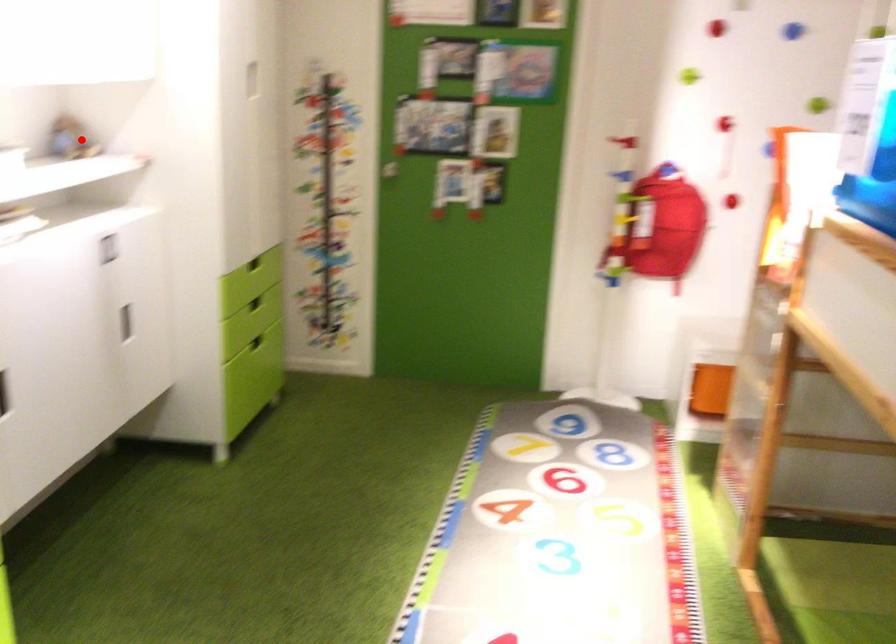
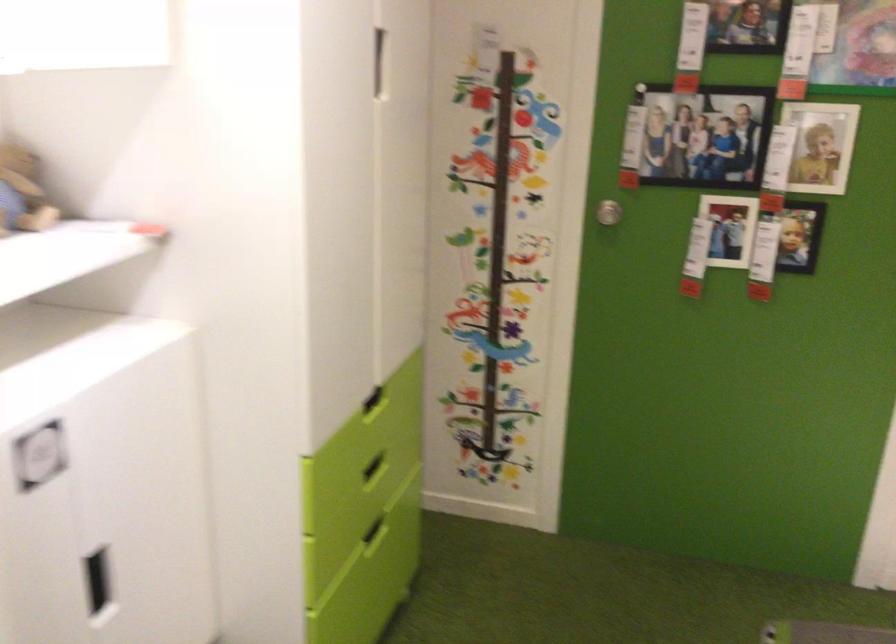
Find the pixel in the second image that matches the highlighted location in the first image.

(22, 192)